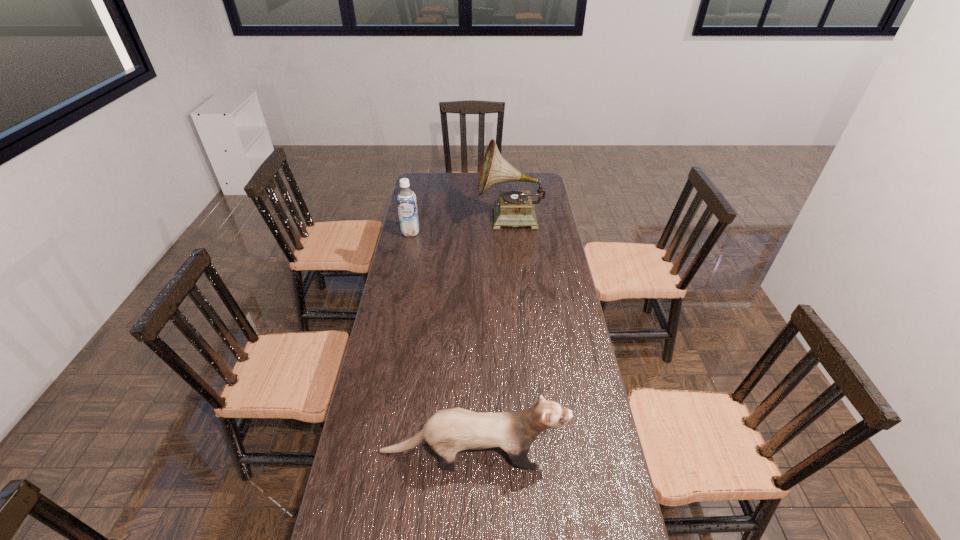
You are a GUI agent. You are given a task and a screenshot of the screen. Output one action in this format:
    pyautogui.click(x=<x>, y=<y>)
    Task: Click on the tallest object
    This screenshot has width=960, height=540.
    Given the screenshot: What is the action you would take?
    pyautogui.click(x=514, y=208)

Where is `the second shortest object`? The height and width of the screenshot is (540, 960). the second shortest object is located at coordinates (406, 200).

The height and width of the screenshot is (540, 960). Find the location of `the shortest object`. the shortest object is located at coordinates coord(449,431).

You are a GUI agent. You are given a task and a screenshot of the screen. Output one action in this format:
    pyautogui.click(x=<x>, y=<y>)
    Task: Click on the ferret
    Image resolution: width=960 pixels, height=540 pixels.
    Given the screenshot: What is the action you would take?
    pyautogui.click(x=449, y=431)

The width and height of the screenshot is (960, 540). What are the coordinates of `vacant space situated 0.140m from the horn of the record player` in the screenshot? It's located at (448, 219).

Identify the location of free location located 0.290m from the horn of the record player. (418, 219).

The width and height of the screenshot is (960, 540). In order to click on free space located from the horn of the record player in this screenshot , I will do `click(432, 219)`.

The image size is (960, 540). Identify the location of vacant space situated 0.130m on the label of the soya milk. (406, 254).

At what (x,y) coordinates should I click in order to perform the action: click on vacant area situated 0.100m on the face of the nearest object. Please return your answer as a coordinate pair (x, y). Looking at the image, I should click on (600, 451).

In order to click on soya milk situated at the left edge in this screenshot , I will do `click(406, 200)`.